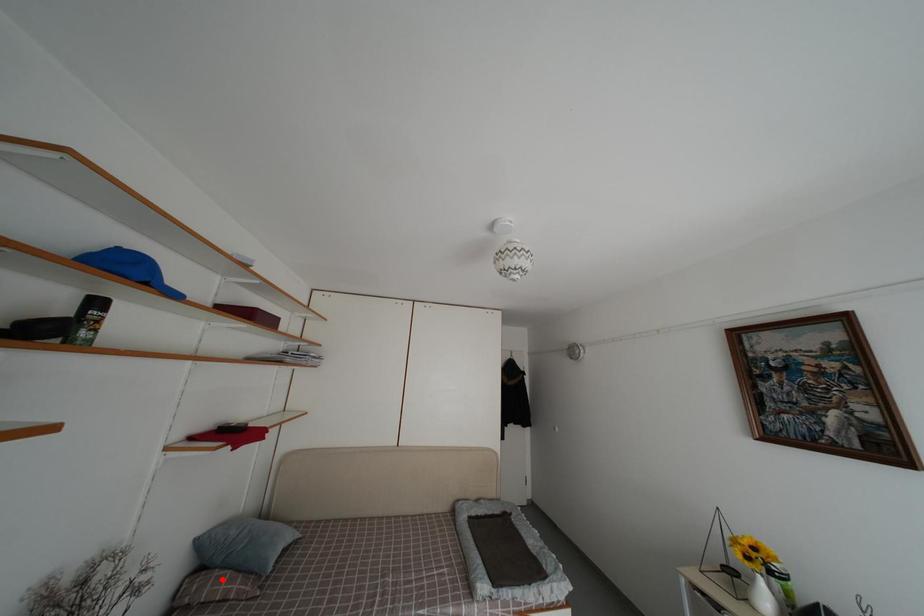
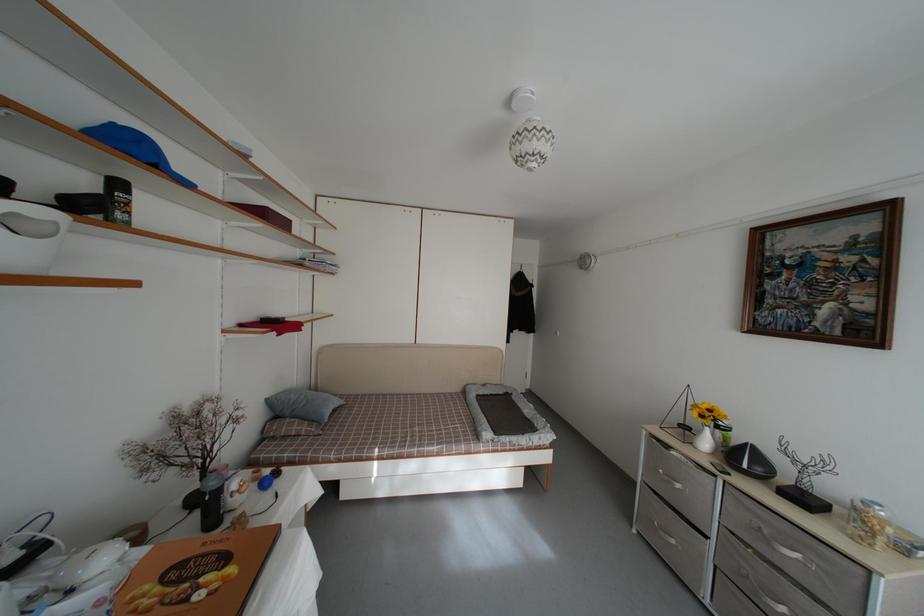
In the second image, find the point that corresponds to the highlighted location in the first image.

(294, 427)